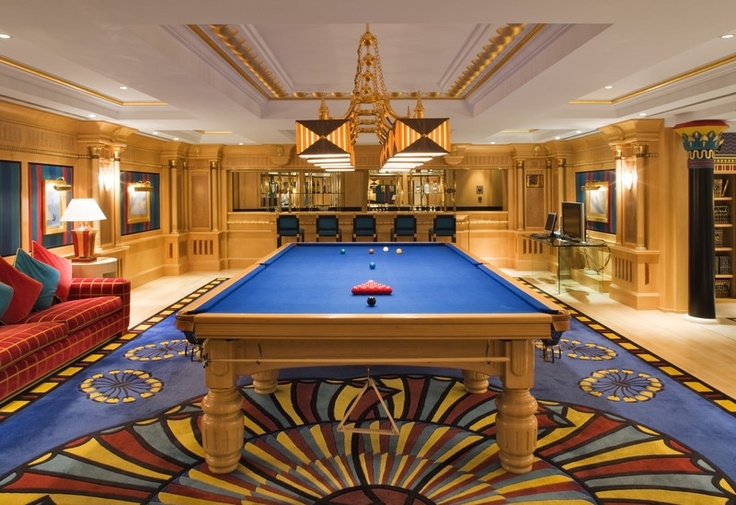
Locate an element on the screen. The image size is (736, 505). red pillow is located at coordinates (29, 288), (68, 265).